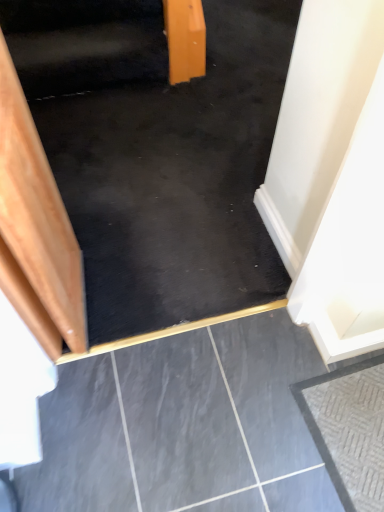
Question: Is black rubber stairwell at upper center a part of wooden stairs at left?

Choices:
 (A) yes
 (B) no

Answer: (B)

Question: Considering the relative sizes of wooden stairs at left and black rubber stairwell at upper center in the image provided, is wooden stairs at left thinner than black rubber stairwell at upper center?

Choices:
 (A) yes
 (B) no

Answer: (B)

Question: Is wooden stairs at left in front of black rubber stairwell at upper center?

Choices:
 (A) yes
 (B) no

Answer: (A)

Question: From the image's perspective, is wooden stairs at left under black rubber stairwell at upper center?

Choices:
 (A) yes
 (B) no

Answer: (A)

Question: From the image's perspective, is wooden stairs at left above black rubber stairwell at upper center?

Choices:
 (A) yes
 (B) no

Answer: (B)

Question: In terms of width, does black polished concrete at center, the second concrete positioned from the right, look wider or thinner when compared to textured gray concrete at lower right, the second concrete positioned from the left?

Choices:
 (A) wide
 (B) thin

Answer: (A)

Question: Is black polished concrete at center, placed as the 1th concrete when sorted from left to right, spatially inside textured gray concrete at lower right, which appears as the first concrete when viewed from the right, or outside of it?

Choices:
 (A) inside
 (B) outside

Answer: (B)

Question: From a real-world perspective, is black polished concrete at center, placed as the 1th concrete when sorted from left to right, positioned above or below textured gray concrete at lower right, which appears as the first concrete when viewed from the right?

Choices:
 (A) below
 (B) above

Answer: (A)

Question: Considering the positions of black polished concrete at center, placed as the 1th concrete when sorted from left to right, and textured gray concrete at lower right, the second concrete positioned from the left, in the image, is black polished concrete at center, placed as the 1th concrete when sorted from left to right, bigger or smaller than textured gray concrete at lower right, the second concrete positioned from the left,?

Choices:
 (A) small
 (B) big

Answer: (B)

Question: Looking at the image, does black rubber stairwell at upper center seem bigger or smaller compared to black polished concrete at center, the second concrete positioned from the right?

Choices:
 (A) big
 (B) small

Answer: (A)

Question: In the image, is black rubber stairwell at upper center on the left side or the right side of black polished concrete at center, placed as the 1th concrete when sorted from left to right?

Choices:
 (A) right
 (B) left

Answer: (B)

Question: From the image's perspective, relative to black polished concrete at center, the second concrete positioned from the right, is black rubber stairwell at upper center above or below?

Choices:
 (A) below
 (B) above

Answer: (B)

Question: Is black rubber stairwell at upper center wider or thinner than black polished concrete at center, the second concrete positioned from the right?

Choices:
 (A) wide
 (B) thin

Answer: (B)

Question: Considering the relative positions of black polished concrete at center, placed as the 1th concrete when sorted from left to right, and black rubber stairwell at upper center in the image provided, is black polished concrete at center, placed as the 1th concrete when sorted from left to right, to the left or to the right of black rubber stairwell at upper center?

Choices:
 (A) left
 (B) right

Answer: (B)

Question: Is point tap(213, 443) positioned closer to the camera than point tap(81, 91)?

Choices:
 (A) farther
 (B) closer

Answer: (B)